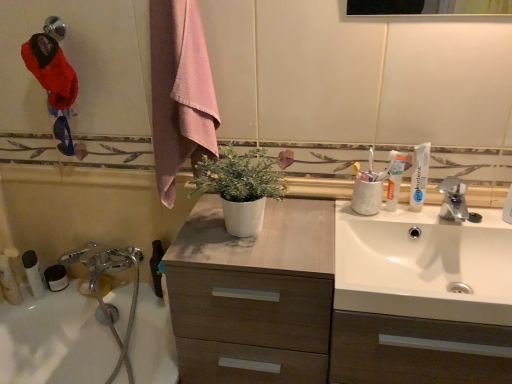
Question: In terms of width, does white plastic tube at lower left, arranged as the 2th toiletry when viewed from the left, look wider or thinner when compared to silver metallic faucet at upper right?

Choices:
 (A) thin
 (B) wide

Answer: (A)

Question: From a real-world perspective, is white plastic tube at lower left, arranged as the 2th toiletry when viewed from the left, physically located above or below silver metallic faucet at upper right?

Choices:
 (A) below
 (B) above

Answer: (A)

Question: Estimate the real-world distances between objects in this image. Which object is closer to the white plastic tube at lower left, placed as the third toiletry when sorted from right to left?

Choices:
 (A) pink cotton towel at upper center
 (B) wooden cabinet at center
 (C) white glossy bathtub at lower left
 (D) white plastic tube at lower left, arranged as the 2th toiletry when viewed from the left
 (E) white matte toothpaste at upper right, the second toothpaste viewed from the left

Answer: (D)

Question: Based on their relative distances, which object is farther from the white glossy bathtub at lower left?

Choices:
 (A) white matte toothpaste at upper right, the first toothpaste from the left
 (B) white matte toothpaste at upper right, the second toothpaste viewed from the left
 (C) white matte pot at center
 (D) white plastic tube at left, placed as the first toiletry when sorted from right to left
 (E) white plastic tube at lower left, the second toiletry viewed from the right

Answer: (A)